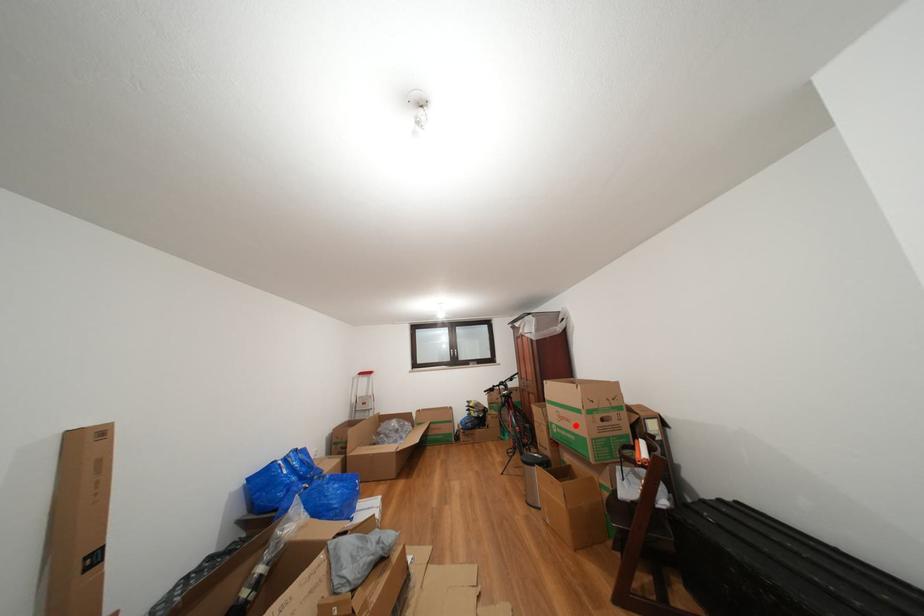
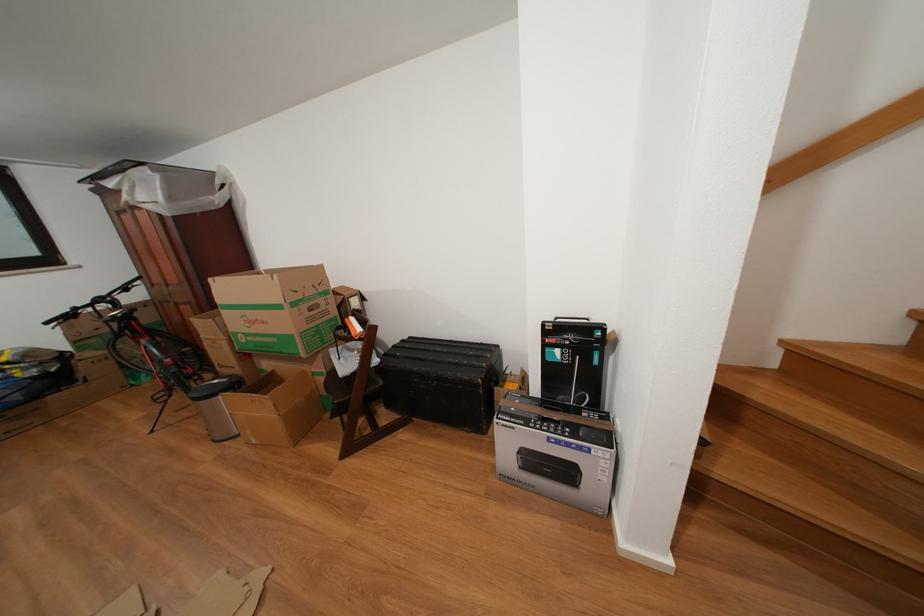
Question: A red point is marked in image1. In image2, is the corresponding 3D point closer to the camera or farther? Reply with the corresponding letter.

Choices:
 (A) The corresponding 3D point is closer.
 (B) The corresponding 3D point is farther.

Answer: (A)